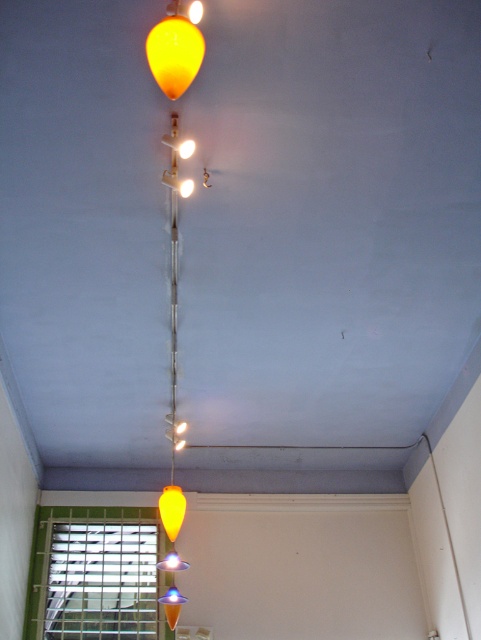
Question: Which point is closer to the camera taking this photo?

Choices:
 (A) (175, 486)
 (B) (159, 32)

Answer: (B)

Question: Is translucent yellow balloon at upper center positioned in front of matte yellow cone at center?

Choices:
 (A) yes
 (B) no

Answer: (A)

Question: Can you confirm if translucent yellow balloon at upper center is positioned above matte yellow cone at center?

Choices:
 (A) no
 (B) yes

Answer: (B)

Question: Which of the following is the farthest from the observer?

Choices:
 (A) translucent yellow balloon at upper center
 (B) matte yellow cone at center

Answer: (B)

Question: Observing the image, what is the correct spatial positioning of translucent yellow balloon at upper center in reference to matte yellow cone at center?

Choices:
 (A) left
 (B) right

Answer: (B)